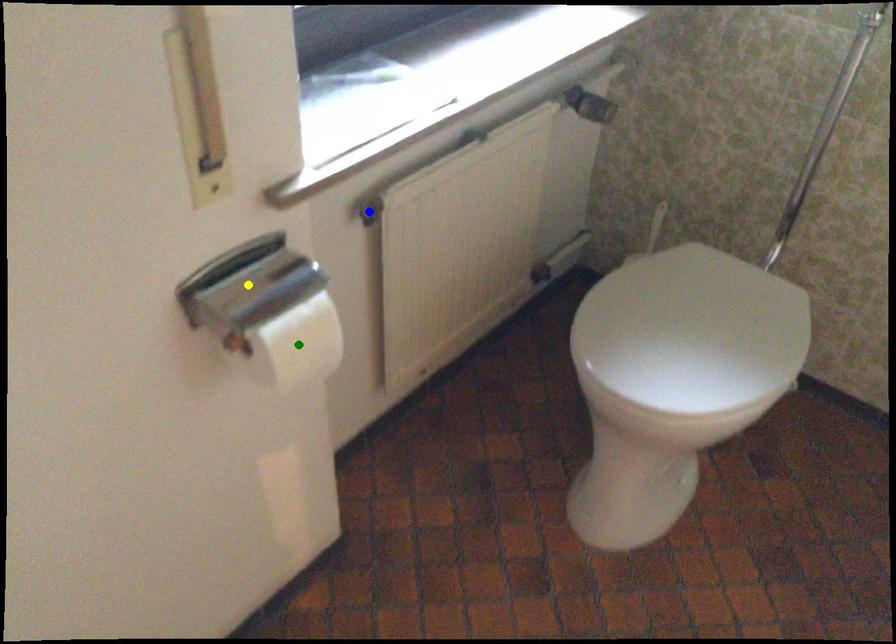
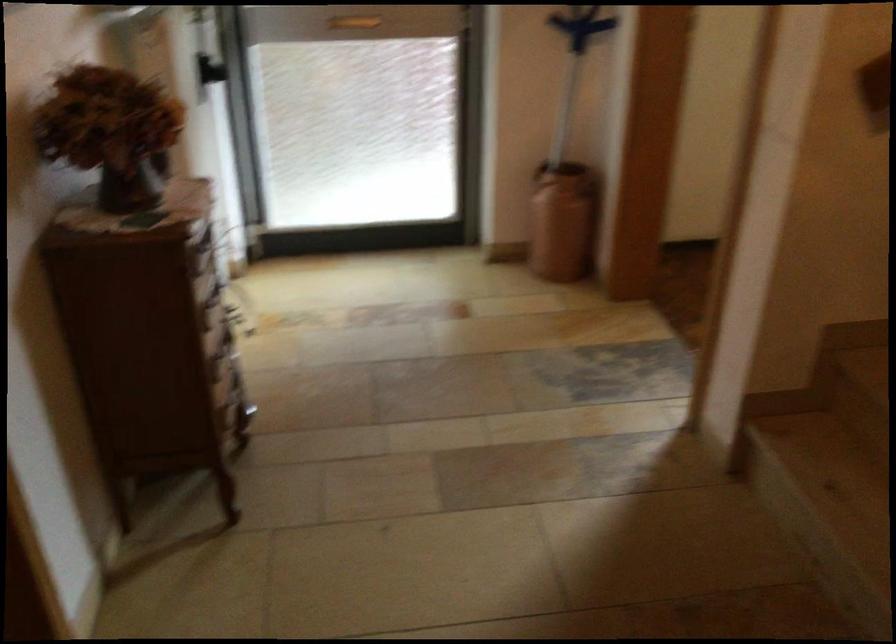
I am providing you with two images of the same scene from different viewpoints. Three points are marked in image1. Which point corresponds to a part or object that is occluded in image2?In image1, three points are marked. Which of them correspond to a part or object that is occluded in image2?Among the three points shown in image1, which one corresponds to a part or object that is no longer visible due to occlusion in image2?

green point, blue point, yellow point